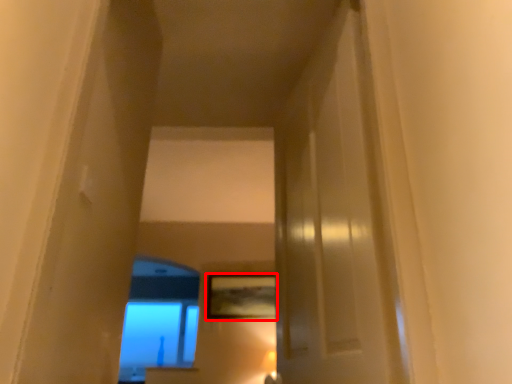
Question: From the image's perspective, where is picture frame (annotated by the red box) located relative to window?

Choices:
 (A) below
 (B) above

Answer: (B)